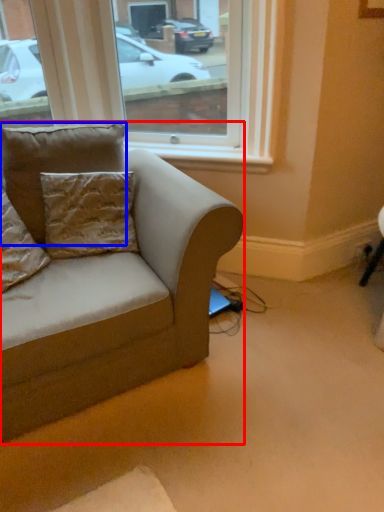
Question: Which object appears farthest to the camera in this image, studio couch (highlighted by a red box) or pillow (highlighted by a blue box)?

Choices:
 (A) studio couch
 (B) pillow

Answer: (B)